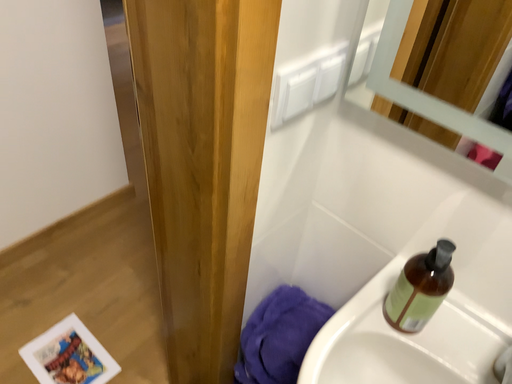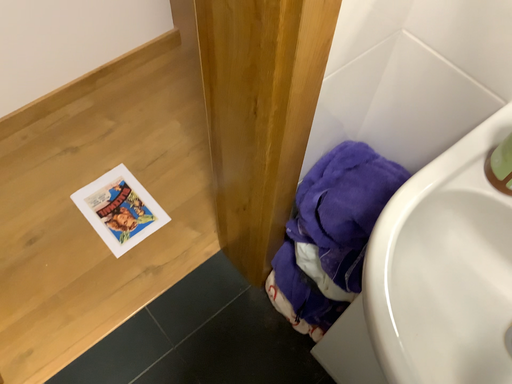
Question: Which way did the camera rotate in the video?

Choices:
 (A) rotated right
 (B) rotated left

Answer: (B)